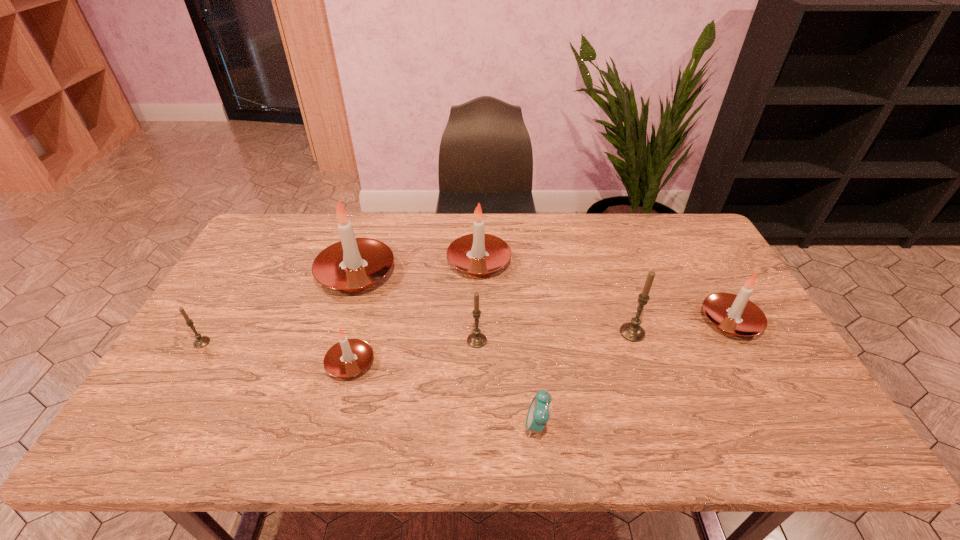
Locate an element on the screen. This screenshot has height=540, width=960. the biggest white candle is located at coordinates (352, 264).

At what (x,y) coordinates should I click in order to perform the action: click on the tallest candle. Please return your answer as a coordinate pair (x, y). Looking at the image, I should click on (352, 264).

Find the location of `the third smallest white candle`. the third smallest white candle is located at coordinates (478, 254).

Locate an element on the screen. the sixth candle from left to right is located at coordinates (633, 332).

At what (x,y) coordinates should I click in order to perform the action: click on the biggest gray candle. Please return your answer as a coordinate pair (x, y). The image size is (960, 540). Looking at the image, I should click on (633, 332).

The height and width of the screenshot is (540, 960). I want to click on the second smallest white candle, so click(736, 315).

The image size is (960, 540). Identify the location of the rightmost white candle. (736, 315).

Find the location of a particular element. Image resolution: width=960 pixels, height=540 pixels. the second gray candle from right to left is located at coordinates (476, 339).

Find the location of a particular element. the smallest white candle is located at coordinates (349, 357).

The width and height of the screenshot is (960, 540). I want to click on the smallest gray candle, so click(x=200, y=342).